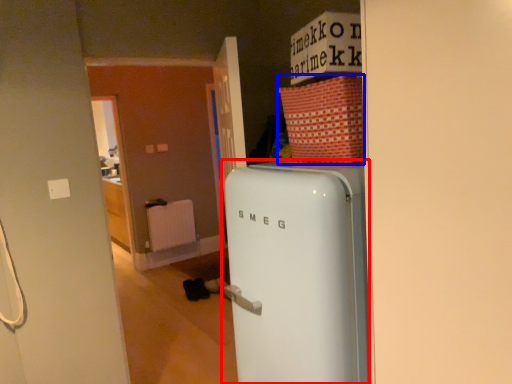
Question: Which point is closer to the camera, refrigerator (highlighted by a red box) or cardboard box (highlighted by a blue box)?

Choices:
 (A) refrigerator
 (B) cardboard box

Answer: (A)